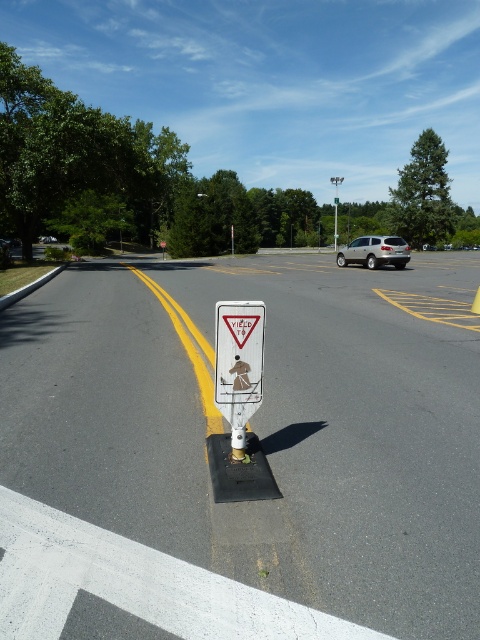
Is satin gold suv at center-right below white plastic sign at center?

Correct, satin gold suv at center-right is located below white plastic sign at center.

Which is below, satin gold suv at center-right or white plastic sign at center?

satin gold suv at center-right is lower down.

Identify the location of satin gold suv at center-right. Image resolution: width=480 pixels, height=640 pixels. (374, 252).

This screenshot has height=640, width=480. Find the location of `satin gold suv at center-right`. satin gold suv at center-right is located at coordinates (374, 252).